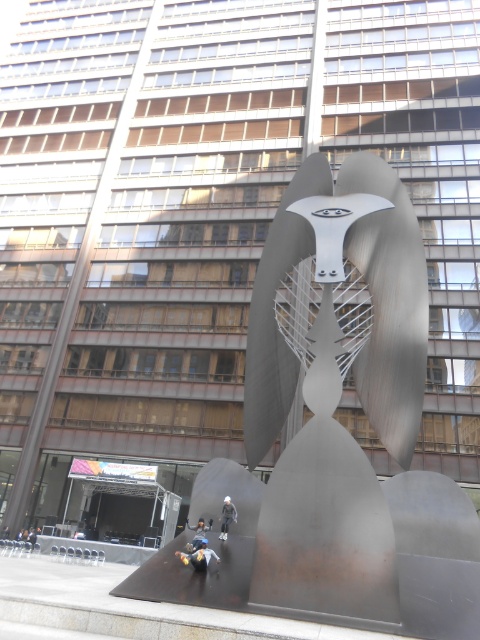
You are a photographer standing in the plaza and want to take a photo of the polished metal sculpture at center without any obstructions. Since the blue denim jeans at lower center are blocking the view, how can you adjust your position to capture the sculpture clearly?

The polished metal sculpture at center is located above the blue denim jeans at lower center, so you can move to a higher position or angle your camera upwards to avoid the obstruction caused by the blue denim jeans at lower center.

You are standing in the plaza and want to take a photo of the blue denim jeans at lower center without the polished metal sculpture at center appearing in the frame. Which direction should you move to achieve this?

Move to the left of the blue denim jeans at lower center so that the polished metal sculpture at center, which is to the right of the blue denim jeans at lower center, is no longer in the frame.

You are standing at the entrance of the plaza and want to take a photo of the polished metal sculpture at center. If the entrance is at coordinate point 0.0, where should you position yourself to ensure the sculpture is fully in frame?

The polished metal sculpture at center is located at coordinate point (336, 428), so you should position yourself at a point closer to (336, 428) to ensure it is fully in frame.